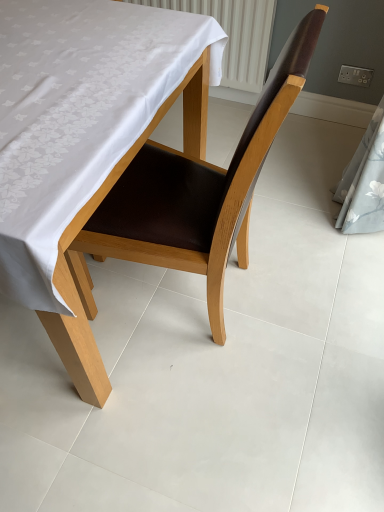
Question: From a real-world perspective, relative to brown leather chair at center, is white fabric-covered table at center vertically above or below?

Choices:
 (A) above
 (B) below

Answer: (B)

Question: Would you say white fabric-covered table at center is inside or outside brown leather chair at center?

Choices:
 (A) outside
 (B) inside

Answer: (A)

Question: Looking at the image, does white fabric-covered table at center seem bigger or smaller compared to brown leather chair at center?

Choices:
 (A) small
 (B) big

Answer: (B)

Question: Do you think brown leather chair at center is within white fabric-covered table at center, or outside of it?

Choices:
 (A) outside
 (B) inside

Answer: (B)

Question: From a real-world perspective, is brown leather chair at center above or below white fabric-covered table at center?

Choices:
 (A) below
 (B) above

Answer: (B)

Question: Is brown leather chair at center wider or thinner than white fabric-covered table at center?

Choices:
 (A) thin
 (B) wide

Answer: (A)

Question: Is brown leather chair at center to the left or to the right of white fabric-covered table at center in the image?

Choices:
 (A) right
 (B) left

Answer: (A)